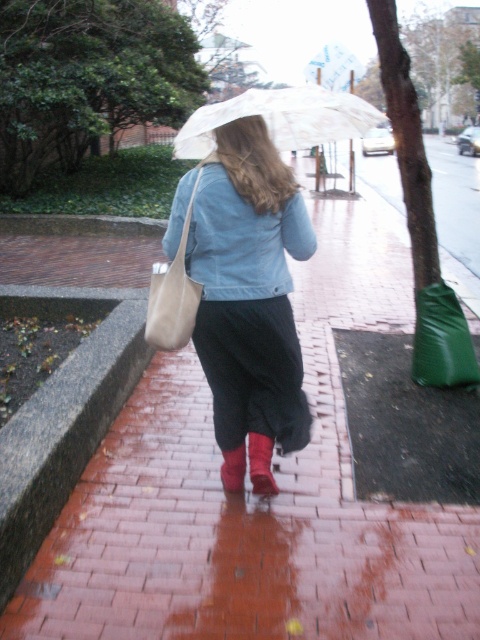
Question: Which of the following is the farthest from the observer?

Choices:
 (A) matte black skirt at center
 (B) green matte shopping bag at lower right
 (C) rubber matte boot at lower center

Answer: (B)

Question: Which point is closer to the camera?

Choices:
 (A) (441, 326)
 (B) (272, 492)

Answer: (B)

Question: Is rubber matte boot at lower center above red suede boot at lower center?

Choices:
 (A) yes
 (B) no

Answer: (A)

Question: Which point appears closest to the camera in this image?

Choices:
 (A) (440, 326)
 (B) (180, 307)
 (C) (254, 400)

Answer: (B)

Question: Is green matte shopping bag at lower right positioned at the back of red suede boot at lower center?

Choices:
 (A) yes
 (B) no

Answer: (A)

Question: Can you confirm if matte black skirt at center is positioned below beige leather bag at center?

Choices:
 (A) no
 (B) yes

Answer: (B)